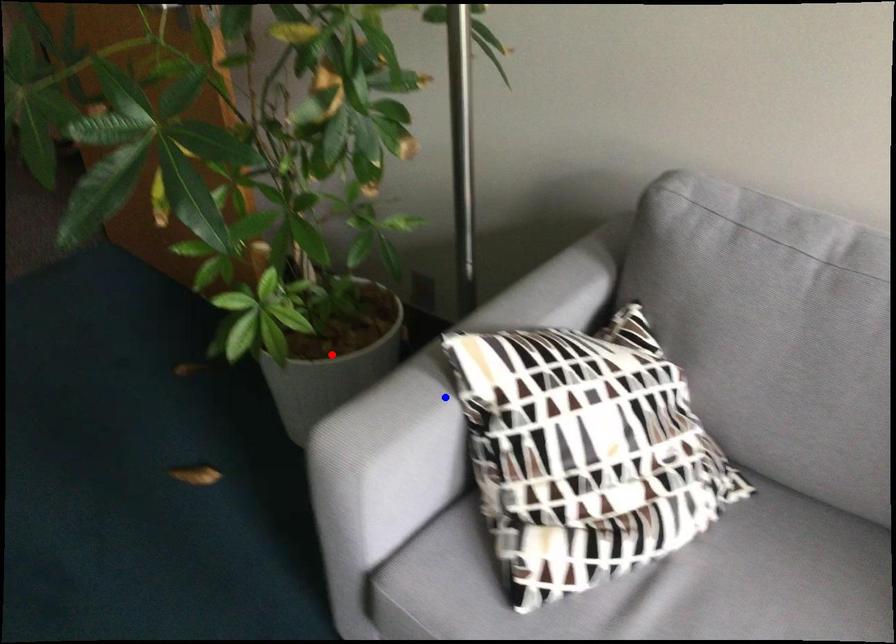
Question: In the image, two points are highlighted. Which point is nearer to the camera? Reply with the corresponding letter.

Choices:
 (A) blue point
 (B) red point

Answer: (A)